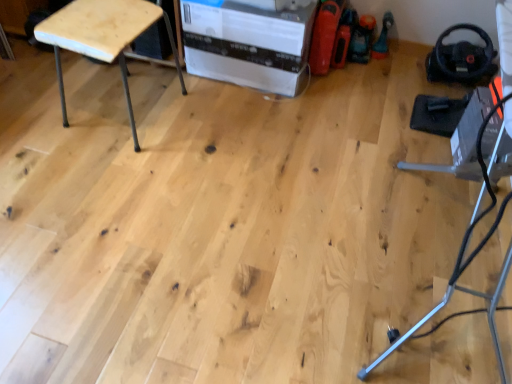
Question: Can you confirm if natural wood stool at upper left is thinner than white cardboard box at center?

Choices:
 (A) yes
 (B) no

Answer: (A)

Question: Can you confirm if natural wood stool at upper left is positioned to the right of white cardboard box at center?

Choices:
 (A) yes
 (B) no

Answer: (B)

Question: Can you confirm if natural wood stool at upper left is wider than white cardboard box at center?

Choices:
 (A) no
 (B) yes

Answer: (A)

Question: Is natural wood stool at upper left facing away from white cardboard box at center?

Choices:
 (A) yes
 (B) no

Answer: (B)

Question: Is the depth of natural wood stool at upper left less than that of white cardboard box at center?

Choices:
 (A) yes
 (B) no

Answer: (A)

Question: Is natural wood stool at upper left oriented towards white cardboard box at center?

Choices:
 (A) yes
 (B) no

Answer: (B)

Question: Is white cardboard box at center further to camera compared to natural wood stool at upper left?

Choices:
 (A) yes
 (B) no

Answer: (A)

Question: Considering the relative positions of white cardboard box at center and natural wood stool at upper left in the image provided, is white cardboard box at center to the left of natural wood stool at upper left from the viewer's perspective?

Choices:
 (A) yes
 (B) no

Answer: (B)

Question: From the image's perspective, would you say white cardboard box at center is shown under natural wood stool at upper left?

Choices:
 (A) no
 (B) yes

Answer: (A)

Question: Can you confirm if white cardboard box at center is smaller than natural wood stool at upper left?

Choices:
 (A) no
 (B) yes

Answer: (A)

Question: Is white cardboard box at center located outside natural wood stool at upper left?

Choices:
 (A) yes
 (B) no

Answer: (A)

Question: Can you confirm if white cardboard box at center is thinner than natural wood stool at upper left?

Choices:
 (A) yes
 (B) no

Answer: (B)

Question: Is white cardboard box at center bigger or smaller than natural wood stool at upper left?

Choices:
 (A) big
 (B) small

Answer: (A)